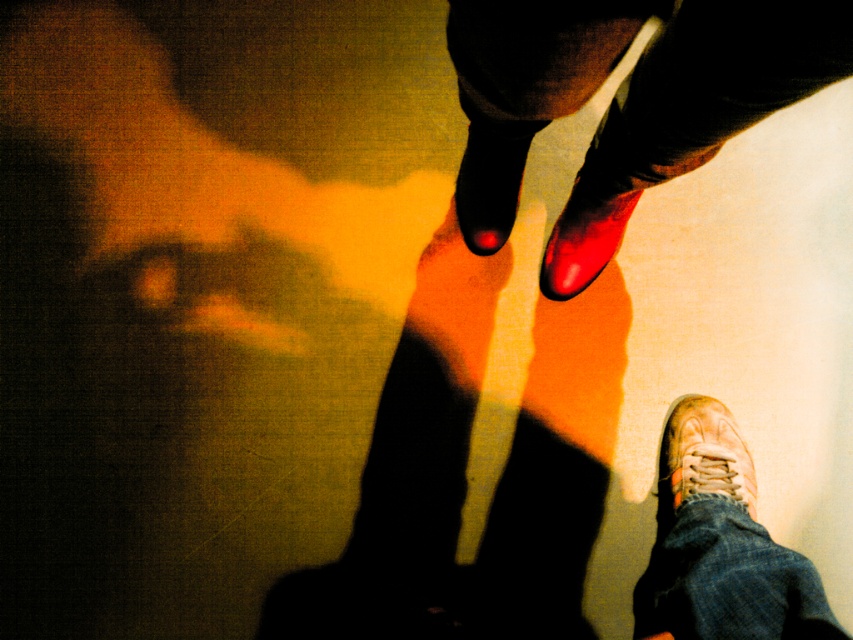
Question: Considering the real-world distances, which object is closest to the shiny black shoe at center?

Choices:
 (A) shiny red shoe at center
 (B) shiny red nail polish at center

Answer: (B)

Question: Considering the relative positions of shiny red nail polish at center and shiny red shoe at center in the image provided, where is shiny red nail polish at center located with respect to shiny red shoe at center?

Choices:
 (A) right
 (B) left

Answer: (B)

Question: In this image, where is shiny red nail polish at center located relative to brown leather shoe at lower right?

Choices:
 (A) below
 (B) above

Answer: (B)

Question: Is shiny red nail polish at center positioned at the back of shiny red shoe at center?

Choices:
 (A) yes
 (B) no

Answer: (B)

Question: Which object appears farthest from the camera in this image?

Choices:
 (A) shiny black shoe at center
 (B) shiny red nail polish at center
 (C) brown leather shoe at lower right
 (D) shiny red shoe at center

Answer: (C)

Question: Which of these objects is positioned farthest from the brown leather shoe at lower right?

Choices:
 (A) shiny red nail polish at center
 (B) shiny red shoe at center
 (C) shiny black shoe at center

Answer: (A)